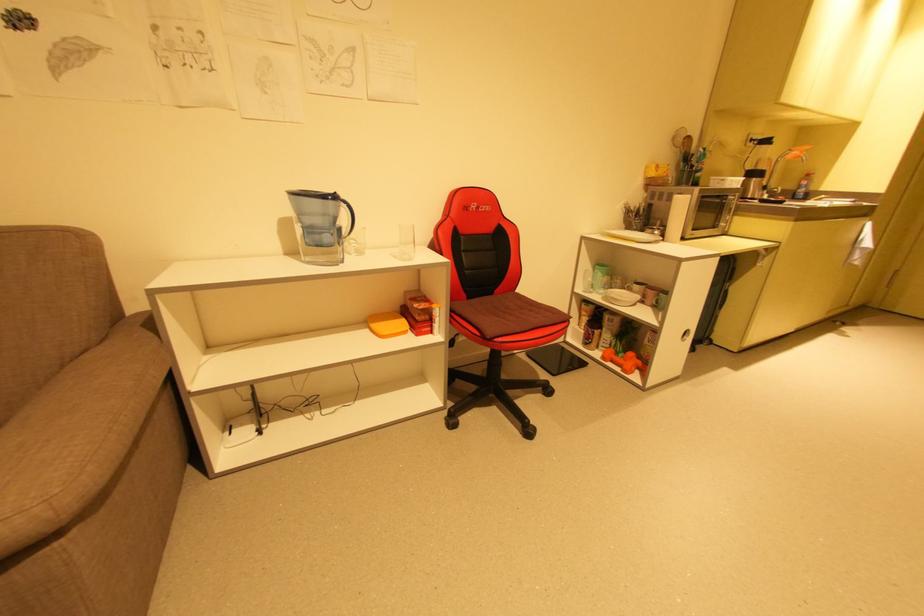
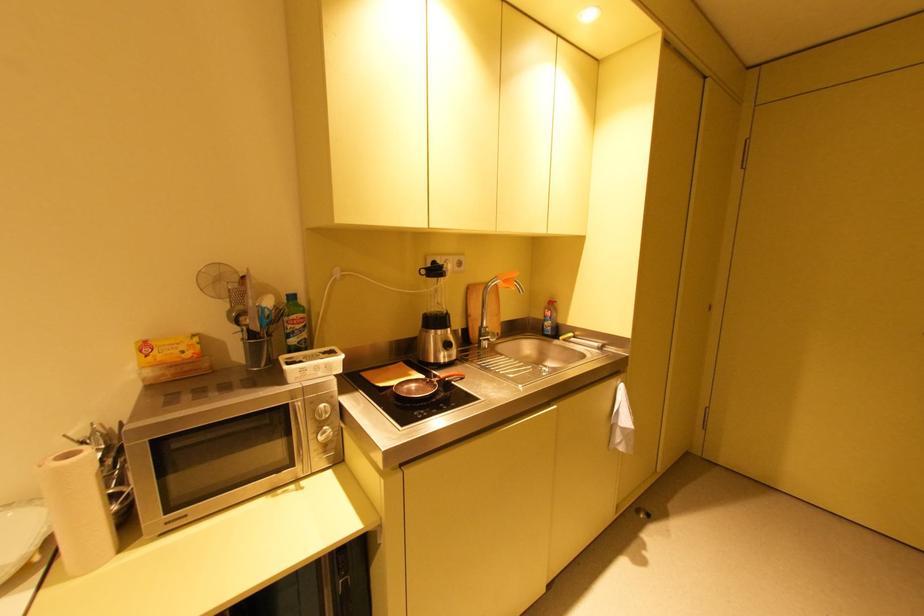
The point at (662, 168) is marked in the first image. Where is the corresponding point in the second image?

(150, 347)